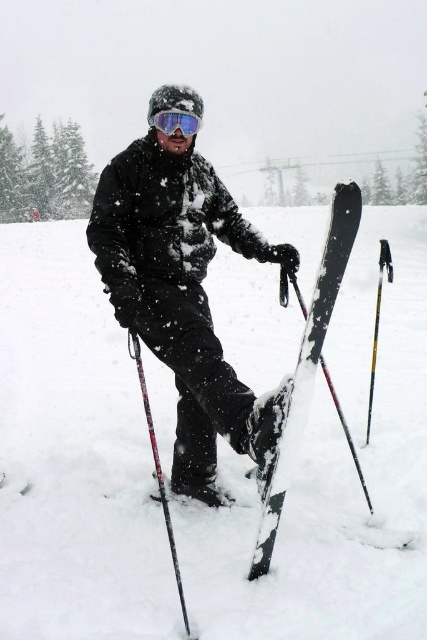
Question: Estimate the real-world distances between objects in this image. Which object is farther from the white fluffy snow at center?

Choices:
 (A) black matte ski at center
 (B) matte black snowboard at center
 (C) transparent blue goggles at center

Answer: (A)

Question: Can you confirm if black textured ski pole at lower left is positioned above transparent blue goggles at center?

Choices:
 (A) no
 (B) yes

Answer: (A)

Question: Does matte black snowboard at center appear under black textured ski pole at lower left?

Choices:
 (A) no
 (B) yes

Answer: (A)

Question: Can you confirm if black matte ski at center is thinner than transparent blue goggles at center?

Choices:
 (A) no
 (B) yes

Answer: (A)

Question: Which object is the farthest from the white fluffy snow at center?

Choices:
 (A) matte black snowboard at center
 (B) transparent blue goggles at center
 (C) black textured ski pole at lower left

Answer: (C)

Question: Which is farther from the transparent blue goggles at center?

Choices:
 (A) matte black snowboard at center
 (B) white fluffy snow at center

Answer: (B)